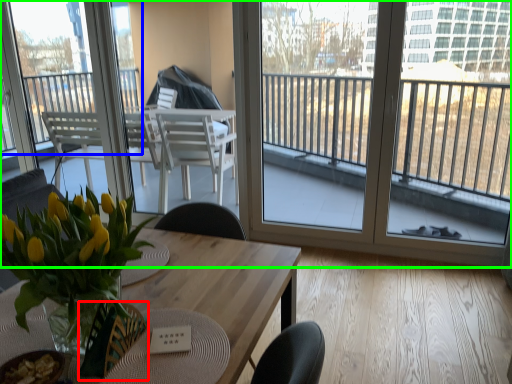
Question: Which is nearer to the armchair (highlighted by a red box)? window (highlighted by a blue box) or window (highlighted by a green box).

Choices:
 (A) window
 (B) window

Answer: (A)